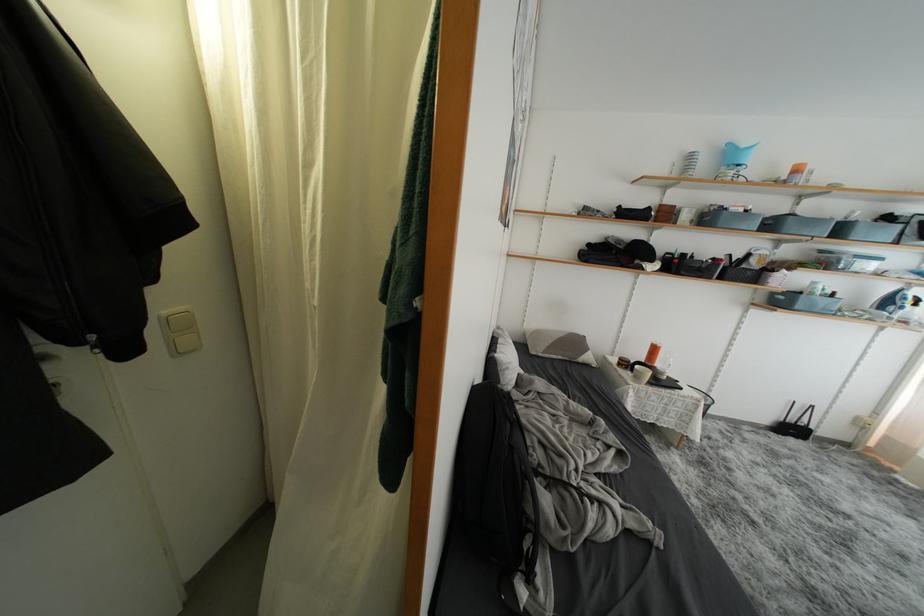
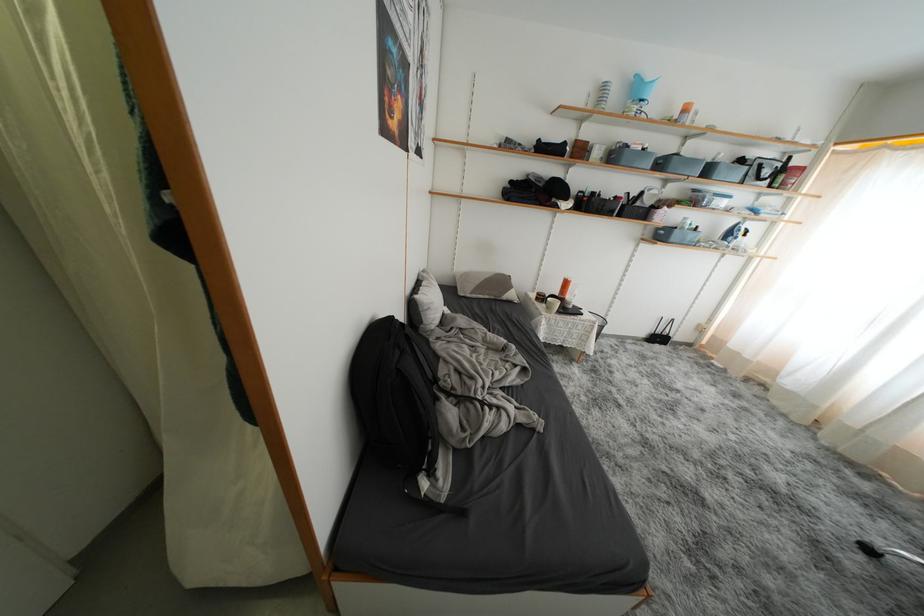
Locate, in the second image, the point that corresponds to the point at 515,430 in the first image.

(404, 357)